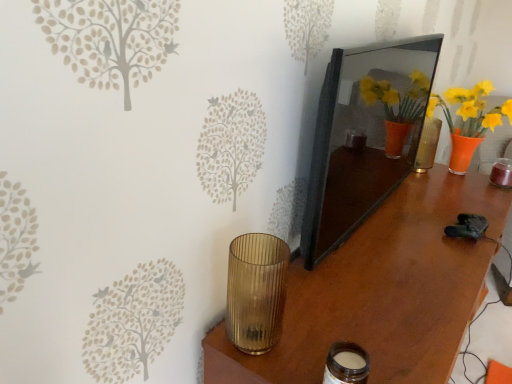
Question: Is matte black mirror at center at the left side of matte glass jar at lower center, which appears as the second candle holder when viewed from the left?

Choices:
 (A) no
 (B) yes

Answer: (A)

Question: Is matte black mirror at center positioned far away from matte glass jar at lower center, which appears as the second candle holder when viewed from the left?

Choices:
 (A) no
 (B) yes

Answer: (A)

Question: Can you confirm if matte black mirror at center is taller than matte glass jar at lower center, acting as the first candle holder starting from the right?

Choices:
 (A) no
 (B) yes

Answer: (B)

Question: Could you tell me if matte black mirror at center is turned towards matte glass jar at lower center, acting as the first candle holder starting from the right?

Choices:
 (A) yes
 (B) no

Answer: (B)

Question: From a real-world perspective, is matte black mirror at center under matte glass jar at lower center, which appears as the second candle holder when viewed from the left?

Choices:
 (A) no
 (B) yes

Answer: (A)

Question: Is matte black mirror at center looking in the opposite direction of matte glass jar at lower center, acting as the first candle holder starting from the right?

Choices:
 (A) no
 (B) yes

Answer: (A)

Question: Is brown wood table at center positioned with its back to matte black mirror at center?

Choices:
 (A) yes
 (B) no

Answer: (B)

Question: Can you confirm if brown wood table at center is bigger than matte black mirror at center?

Choices:
 (A) yes
 (B) no

Answer: (A)

Question: Is matte black mirror at center inside brown wood table at center?

Choices:
 (A) no
 (B) yes

Answer: (A)

Question: Is brown wood table at center at the right side of matte black mirror at center?

Choices:
 (A) no
 (B) yes

Answer: (B)

Question: From a real-world perspective, is brown wood table at center located higher than matte black mirror at center?

Choices:
 (A) yes
 (B) no

Answer: (B)

Question: Considering the relative sizes of brown wood table at center and matte black mirror at center in the image provided, is brown wood table at center shorter than matte black mirror at center?

Choices:
 (A) yes
 (B) no

Answer: (B)

Question: Is gold ribbed glass at lower left, placed as the 2th candle holder when sorted from right to left, bigger than matte glass jar at lower center, which appears as the second candle holder when viewed from the left?

Choices:
 (A) no
 (B) yes

Answer: (B)